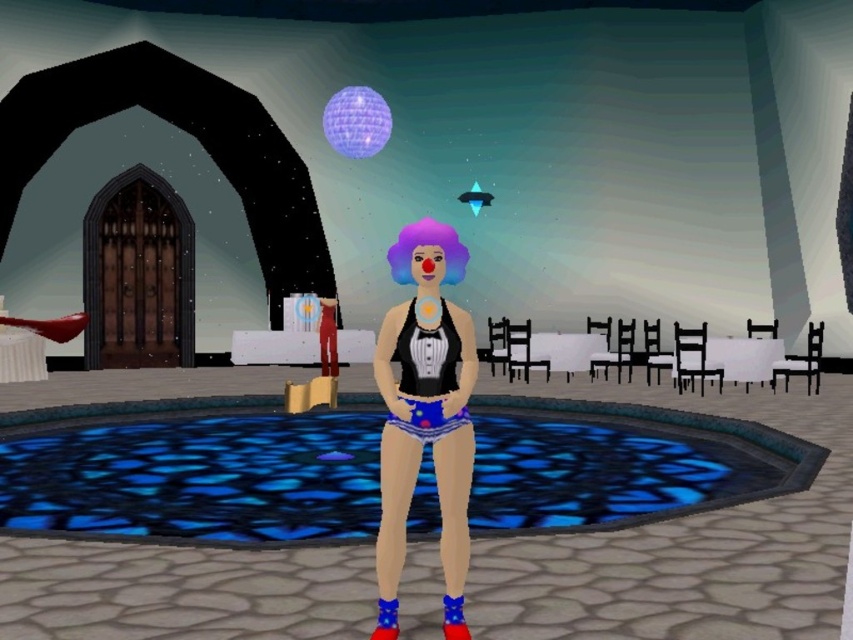
Who is more forward, [231,132] or [410,244]?

Point [410,244] is more forward.

Does point (292, 259) come behind point (461, 269)?

Yes.

The width and height of the screenshot is (853, 640). I want to click on wooden door at left, so click(x=187, y=131).

Is point (460, 477) positioned before point (396, 266)?

Yes, point (460, 477) is closer to viewer.

Does matte black bikini top at center have a lesser width compared to purple synthetic wig at center?

No, matte black bikini top at center is not thinner than purple synthetic wig at center.

Identify the location of matte black bikini top at center. (425, 413).

Is stained glass pool at center smaller than lavender glossy disco ball at upper center?

Yes.

Does stained glass pool at center have a greater height compared to lavender glossy disco ball at upper center?

No, stained glass pool at center is not taller than lavender glossy disco ball at upper center.

At what (x,y) coordinates should I click in order to perform the action: click on stained glass pool at center. Please return your answer as a coordinate pair (x, y). Looking at the image, I should click on (193, 472).